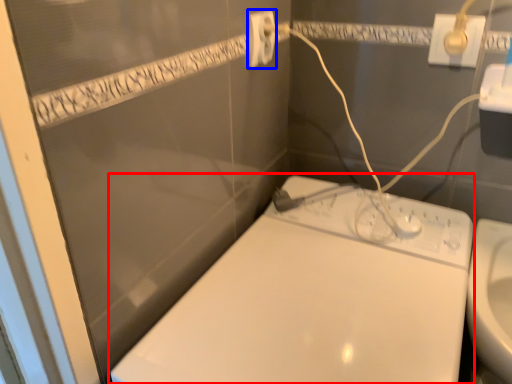
Question: Which of the following is the closest to the observer, toilet (highlighted by a red box) or power plugs and sockets (highlighted by a blue box)?

Choices:
 (A) toilet
 (B) power plugs and sockets

Answer: (A)